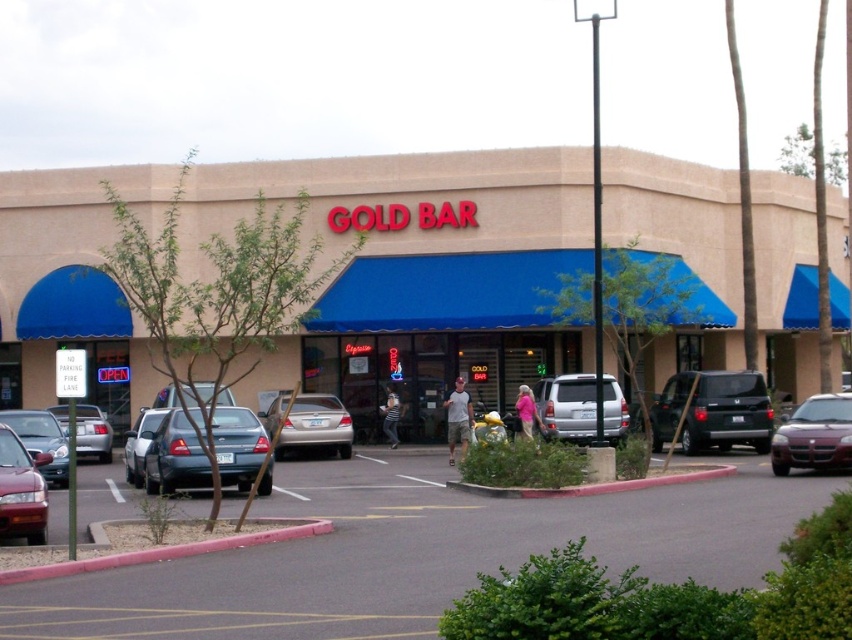
You are a delivery person standing at the entrance of the GOLD BAR building. You need to load a package onto a truck that is 2 meters tall. Can the blue awning at center block the truck from entering the parking space next to the dark gray matte suv at right?

The blue awning at center is much taller than the dark gray matte suv at right. Since the truck is 2 meters tall, the blue awning at center being taller than the suv might indicate it could be an obstruction. However, without knowing the exact height of the awning, it is uncertain if it will block the truck. Please check the awning height before proceeding.